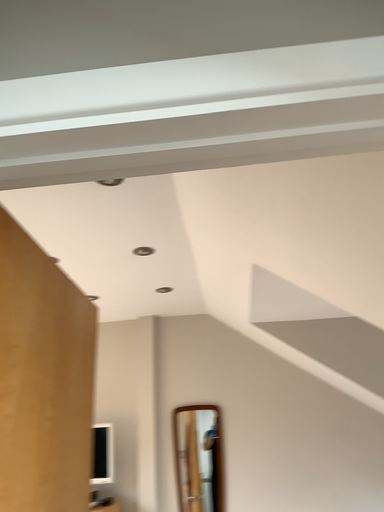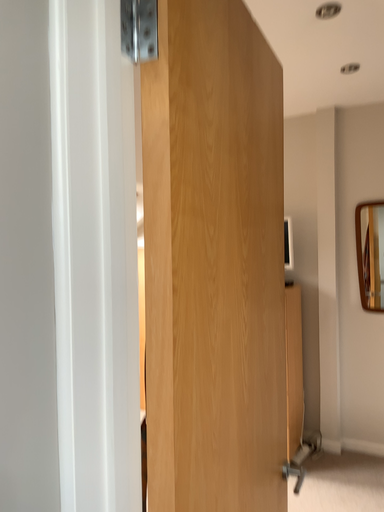
Question: How did the camera likely rotate when shooting the video?

Choices:
 (A) rotated left
 (B) rotated right

Answer: (A)